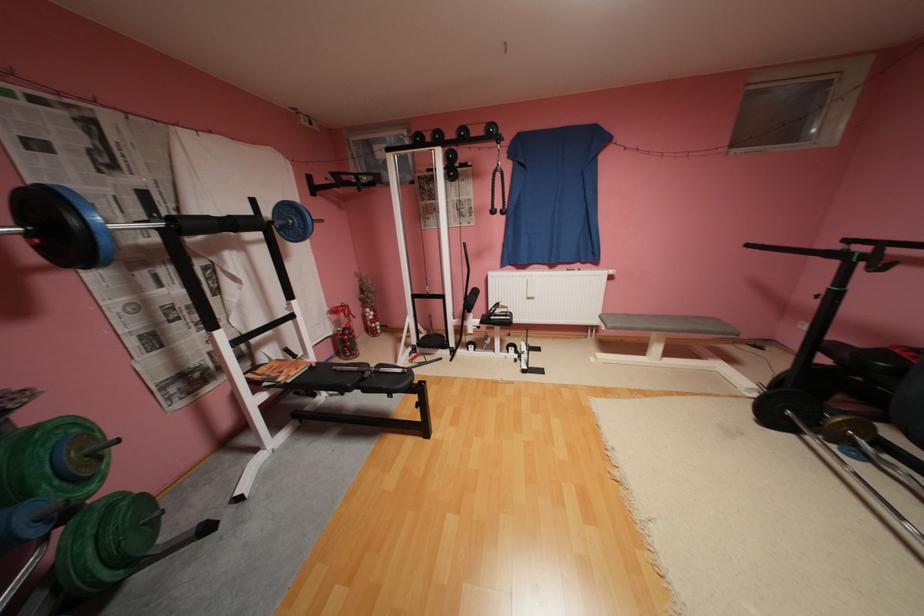
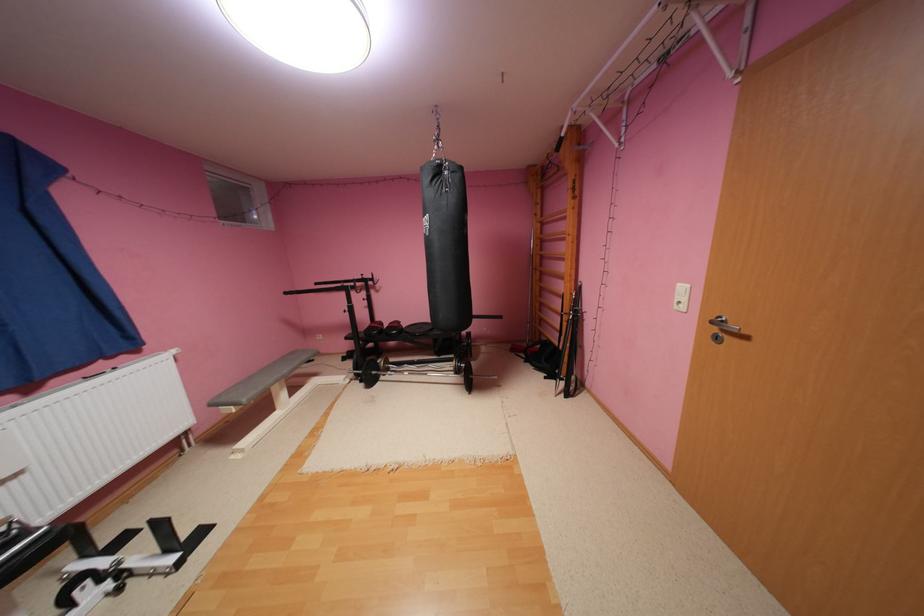
In the second image, find the point that corresponds to (757,246) in the first image.

(295, 293)